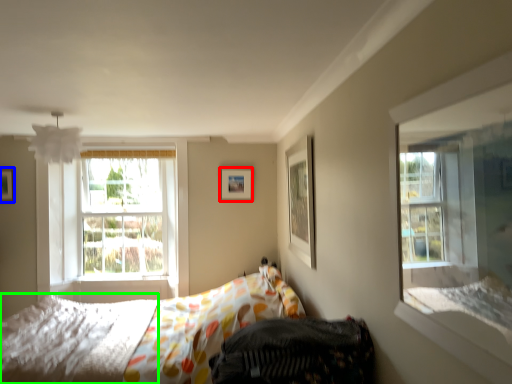
Question: Which object is the closest to the picture frame (highlighted by a red box)? Choose among these: picture frame (highlighted by a blue box) or mattress (highlighted by a green box).

Choices:
 (A) picture frame
 (B) mattress

Answer: (B)